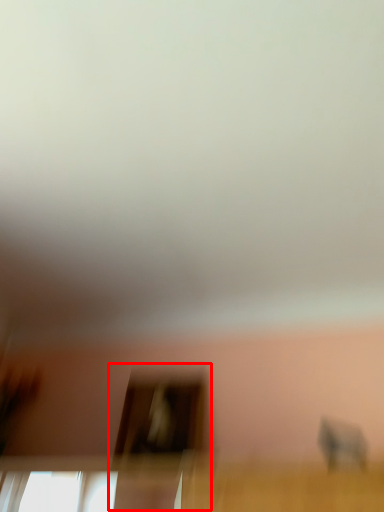
Question: From the image's perspective, considering the relative positions of screen door (annotated by the red box) and baby elephant in the image provided, where is screen door (annotated by the red box) located with respect to the staircase?

Choices:
 (A) below
 (B) above

Answer: (A)